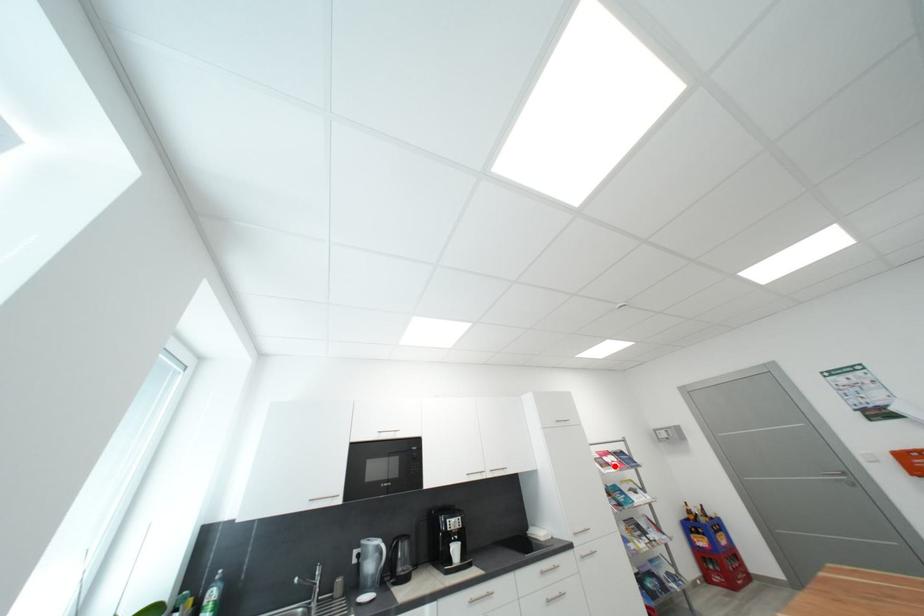
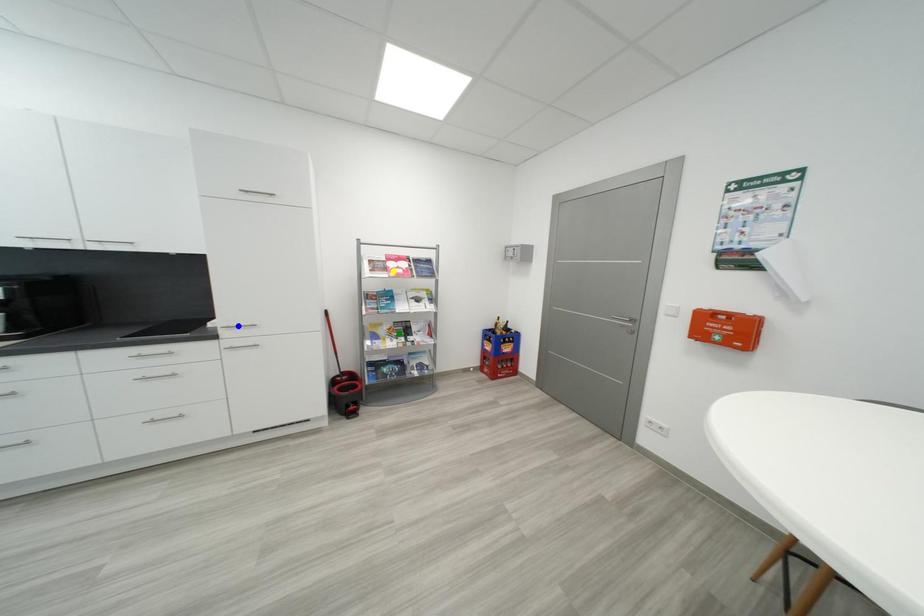
Question: I am providing you with two images of the same scene from different viewpoints. A red point is marked on the first image. You are given multiple points on the second image. In image 2, which mark is for the same physical point as the one in image 1?

Choices:
 (A) blue point
 (B) green point
 (C) yellow point

Answer: (C)